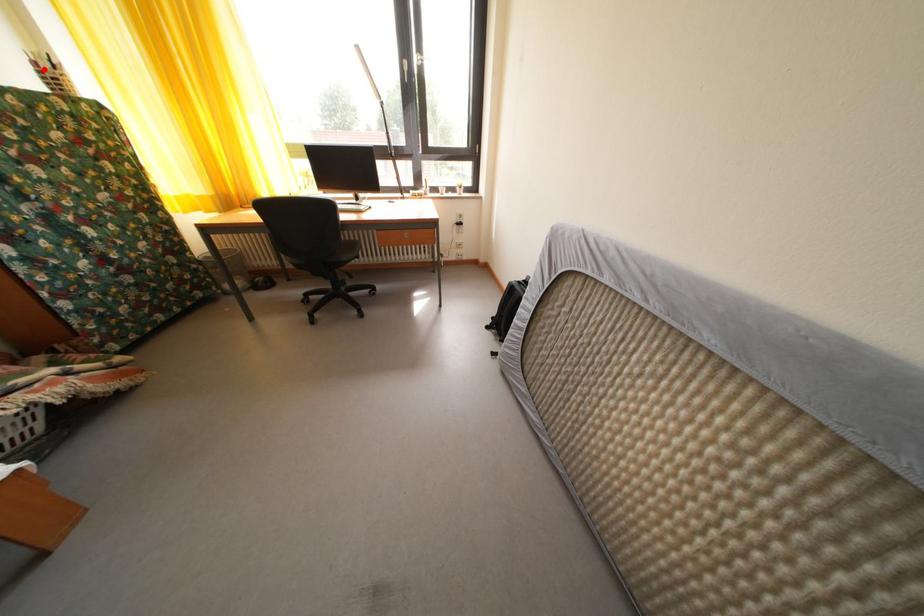
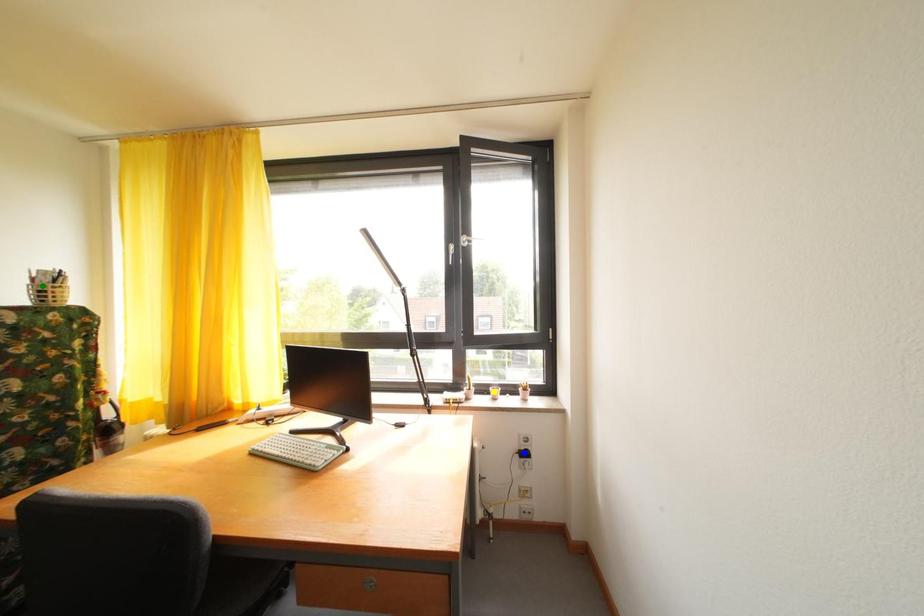
Question: I am providing you with two images of the same scene from different viewpoints. A red point is marked on the first image. You are given multiple points on the second image. Which point in image 2 is actually the same real-world point as the red point in image 1?

Choices:
 (A) yellow point
 (B) green point
 (C) blue point

Answer: (B)